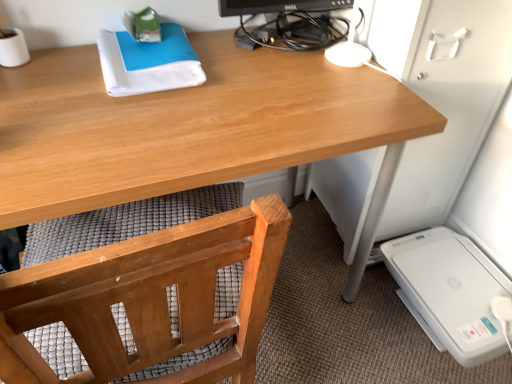
The height and width of the screenshot is (384, 512). Describe the element at coordinates (186, 125) in the screenshot. I see `wooden desk at center` at that location.

Describe the element at coordinates (289, 23) in the screenshot. I see `black glossy monitor at upper center` at that location.

Describe the element at coordinates (451, 292) in the screenshot. The width and height of the screenshot is (512, 384). I see `white plastic printer at lower right` at that location.

Locate an element on the screen. wooden chair at lower left is located at coordinates (148, 305).

Image resolution: width=512 pixels, height=384 pixels. What do you see at coordinates (148, 305) in the screenshot?
I see `wooden chair at lower left` at bounding box center [148, 305].

What are the coordinates of `wooden desk at center` in the screenshot? It's located at (186, 125).

Which object is closer to the camera, black glossy monitor at upper center or wooden desk at center?

wooden desk at center.

Is black glossy monitor at upper center oriented towards wooden desk at center?

No, black glossy monitor at upper center does not turn towards wooden desk at center.

Considering the relative positions of black glossy monitor at upper center and wooden desk at center in the image provided, is black glossy monitor at upper center to the left of wooden desk at center from the viewer's perspective?

No.

From the picture: Considering the relative sizes of black glossy monitor at upper center and wooden desk at center in the image provided, is black glossy monitor at upper center shorter than wooden desk at center?

Correct, black glossy monitor at upper center is not as tall as wooden desk at center.

Is black glossy monitor at upper center next to white plastic printer at lower right and touching it?

No, black glossy monitor at upper center is not next to white plastic printer at lower right.

Considering the relative positions of black glossy monitor at upper center and white plastic printer at lower right in the image provided, is black glossy monitor at upper center in front of white plastic printer at lower right?

Yes, it is in front of white plastic printer at lower right.

From a real-world perspective, does black glossy monitor at upper center stand above white plastic printer at lower right?

Yes, from a real-world perspective, black glossy monitor at upper center is on top of white plastic printer at lower right.

What's the angular difference between black glossy monitor at upper center and white plastic printer at lower right's facing directions?

The angular difference between black glossy monitor at upper center and white plastic printer at lower right is 86.4 degrees.

Does point (126, 373) come closer to viewer compared to point (332, 43)?

Yes, it is.

From a real-world perspective, is wooden chair at lower left positioned under black glossy monitor at upper center based on gravity?

Yes, from a real-world perspective, wooden chair at lower left is below black glossy monitor at upper center.

In the scene shown: Which object is more forward, wooden chair at lower left or black glossy monitor at upper center?

wooden chair at lower left.

Is wooden chair at lower left not within black glossy monitor at upper center?

wooden chair at lower left is positioned outside black glossy monitor at upper center.

Relative to black glossy monitor at upper center, is white plastic printer at lower right in front or behind?

white plastic printer at lower right is positioned farther from the viewer than black glossy monitor at upper center.

Which object is positioned more to the right, white plastic printer at lower right or black glossy monitor at upper center?

From the viewer's perspective, white plastic printer at lower right appears more on the right side.

Can you confirm if white plastic printer at lower right is wider than black glossy monitor at upper center?

Indeed, white plastic printer at lower right has a greater width compared to black glossy monitor at upper center.

Is white plastic printer at lower right inside or outside of black glossy monitor at upper center?

The correct answer is: outside.

Is white plastic printer at lower right closer to the viewer compared to wooden desk at center?

No, it is behind wooden desk at center.

Does point (441, 293) appear closer or farther from the camera than point (60, 150)?

Clearly, point (441, 293) is more distant from the camera than point (60, 150).

From a real-world perspective, which object rests below the other?

white plastic printer at lower right is physically lower.

From the image's perspective, is white plastic printer at lower right on wooden desk at center?

No.

Does black glossy monitor at upper center have a lesser height compared to wooden chair at lower left?

No, black glossy monitor at upper center is not shorter than wooden chair at lower left.

I want to click on desktop computer above the wooden chair at lower left (from a real-world perspective), so click(289, 23).

From the image's perspective, is black glossy monitor at upper center beneath wooden chair at lower left?

Actually, black glossy monitor at upper center appears above wooden chair at lower left in the image.

Could you tell me if black glossy monitor at upper center is facing wooden chair at lower left?

No.

Does point (153, 136) appear closer or farther from the camera than point (439, 298)?

Point (153, 136).

Between wooden desk at center and white plastic printer at lower right, which one has larger size?

Bigger between the two is wooden desk at center.

Between wooden desk at center and white plastic printer at lower right, which one has more height?

With more height is wooden desk at center.

Which object is wider, wooden desk at center or white plastic printer at lower right?

With larger width is wooden desk at center.

The width and height of the screenshot is (512, 384). Identify the location of desktop computer that appears behind the wooden desk at center. (289, 23).

Find the location of a particular element. This screenshot has height=384, width=512. desktop computer in front of the white plastic printer at lower right is located at coordinates (289, 23).

From the image, which object appears to be farther from wooden desk at center, black glossy monitor at upper center or white plastic printer at lower right?

Among the two, white plastic printer at lower right is located further to wooden desk at center.

Looking at the image, which one is located further to black glossy monitor at upper center, white plastic printer at lower right or wooden desk at center?

The object further to black glossy monitor at upper center is white plastic printer at lower right.

Estimate the real-world distances between objects in this image. Which object is further from black glossy monitor at upper center, white plastic printer at lower right or wooden chair at lower left?

Among the two, white plastic printer at lower right is located further to black glossy monitor at upper center.

Looking at the image, which one is located further to wooden desk at center, white plastic printer at lower right or black glossy monitor at upper center?

The object further to wooden desk at center is white plastic printer at lower right.

Estimate the real-world distances between objects in this image. Which object is further from wooden desk at center, black glossy monitor at upper center or wooden chair at lower left?

Among the two, wooden chair at lower left is located further to wooden desk at center.

Which object lies further to the anchor point white plastic printer at lower right, black glossy monitor at upper center or wooden desk at center?

black glossy monitor at upper center is further to white plastic printer at lower right.

Which object lies further to the anchor point wooden chair at lower left, white plastic printer at lower right or black glossy monitor at upper center?

The object further to wooden chair at lower left is white plastic printer at lower right.

Which object lies nearer to the anchor point wooden chair at lower left, white plastic printer at lower right or wooden desk at center?

wooden desk at center is closer to wooden chair at lower left.

Locate an element on the screen. desktop computer between wooden desk at center and white plastic printer at lower right from left to right is located at coordinates (289, 23).

Locate an element on the screen. The height and width of the screenshot is (384, 512). desktop computer located between wooden chair at lower left and white plastic printer at lower right in the left-right direction is located at coordinates (289, 23).

Locate an element on the screen. This screenshot has height=384, width=512. desk between black glossy monitor at upper center and wooden chair at lower left in the up-down direction is located at coordinates (186, 125).

Where is `desk between wooden chair at lower left and white plastic printer at lower right from left to right`? The image size is (512, 384). desk between wooden chair at lower left and white plastic printer at lower right from left to right is located at coordinates (186, 125).